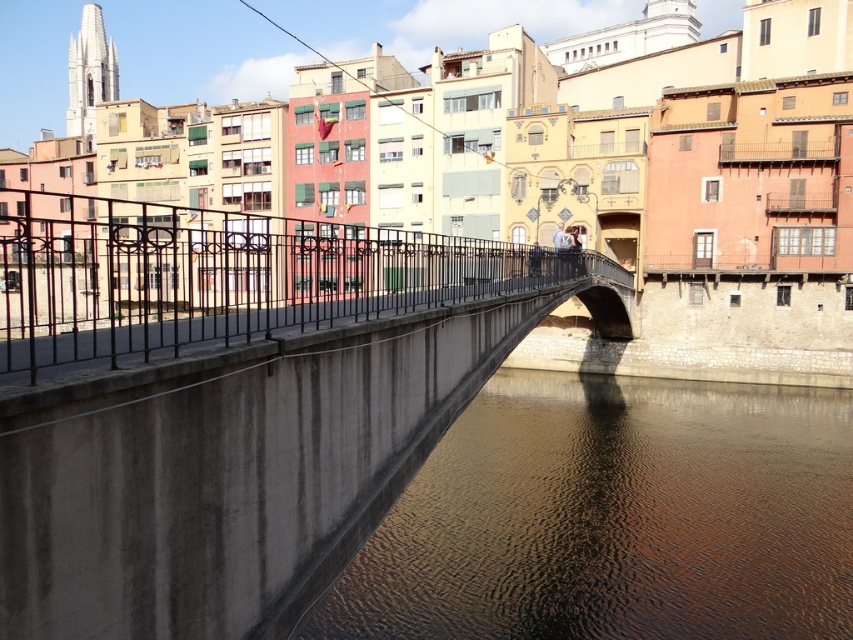
You are standing on the sidewalk near the river and want to cross to the other side. The concrete bridge at center is the only path available. If you start walking towards it at a speed of 1.5 meters per second, how many seconds will it take you to reach the bridge?

The concrete bridge at center is 10.88 meters away from you. Walking at 1.5 meters per second, it will take you approximately 7.25 seconds to reach the bridge.

Based on the photo, you are an architect reviewing a blueprint of the bridge. You notice two elements in the design, the brown concrete water at lower center and the black wrought iron railing at center. Which element takes up more area in the blueprint?

The black wrought iron railing at center takes up more area than the brown concrete water at lower center because the brown concrete water at lower center occupies less space than black wrought iron railing at center.